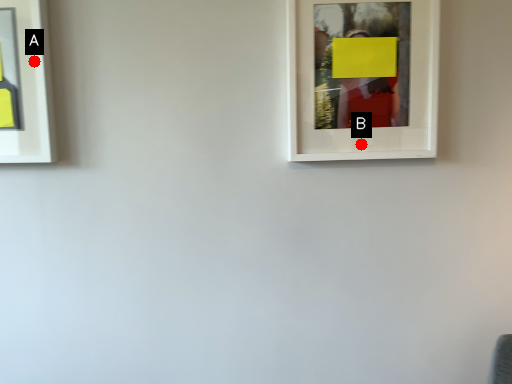
Question: Two points are circled on the image, labeled by A and B beside each circle. Which of the following is the farthest from the observer?

Choices:
 (A) A is further
 (B) B is further

Answer: (B)